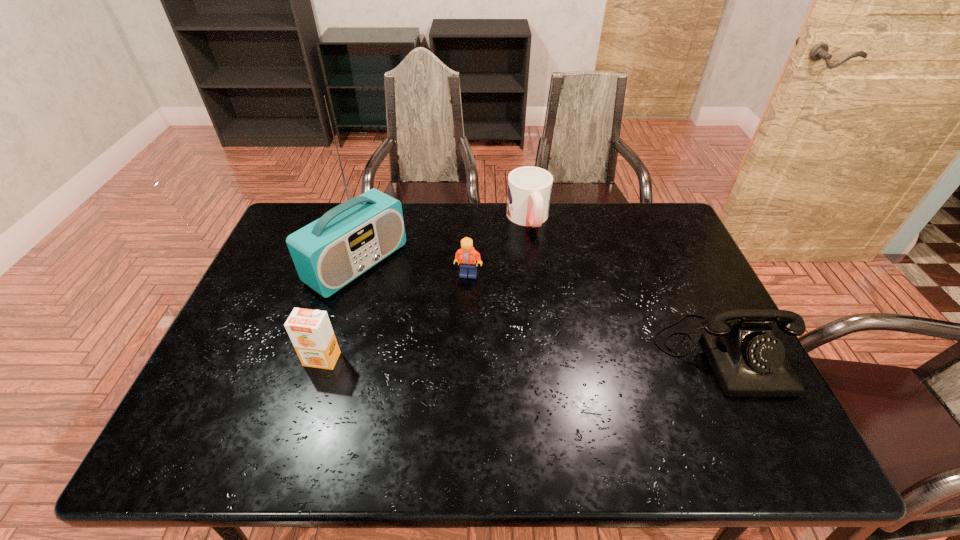
The image size is (960, 540). In order to click on object located at the far left corner in this screenshot , I will do (x=349, y=239).

This screenshot has width=960, height=540. Find the location of `object that is at the near right corner`. object that is at the near right corner is located at coordinates (748, 361).

Identify the location of free space at the far edge of the desktop. (455, 232).

This screenshot has width=960, height=540. I want to click on free space at the near edge, so click(x=473, y=390).

The image size is (960, 540). I want to click on free location at the left edge of the desktop, so 249,363.

The image size is (960, 540). In order to click on free space at the right edge in this screenshot , I will do `click(677, 291)`.

Locate an element on the screen. This screenshot has width=960, height=540. vacant space at the far right corner is located at coordinates (632, 227).

Find the location of a particular element. free spot between the telephone and the orange juice is located at coordinates (523, 356).

I want to click on free space between the orange juice and the Lego, so click(x=396, y=317).

The image size is (960, 540). I want to click on vacant area that lies between the Lego and the radio receiver, so click(x=413, y=269).